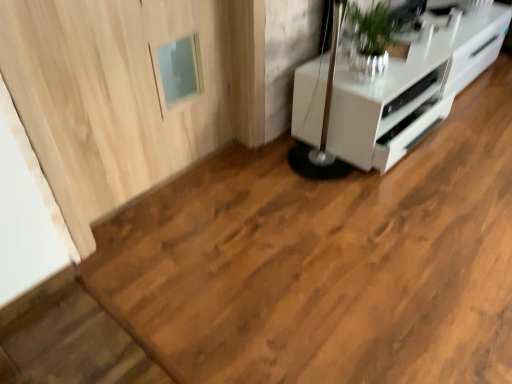
Identify the location of vacant space to the right of green leafy plant at upper right. (410, 66).